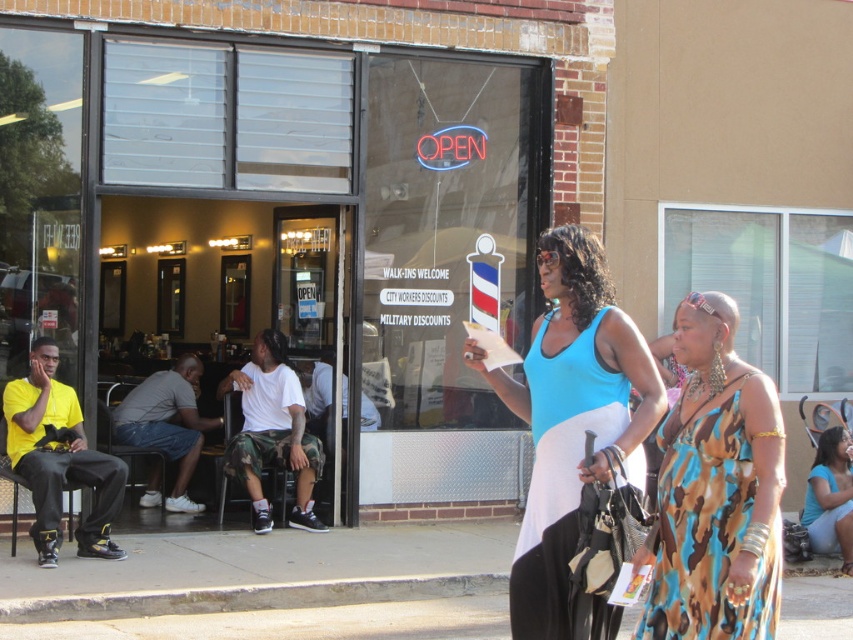
Question: Which of the following is the farthest from the observer?

Choices:
 (A) blue jersey dress at center
 (B) camouflage print dress at right

Answer: (A)

Question: Which of these objects is positioned farthest from the blue jersey dress at center?

Choices:
 (A) camouflage print dress at right
 (B) blue fabric dress at center

Answer: (A)

Question: Is blue fabric dress at center wider than blue jersey dress at center?

Choices:
 (A) no
 (B) yes

Answer: (B)

Question: Does blue fabric dress at center appear on the left side of blue jersey dress at center?

Choices:
 (A) yes
 (B) no

Answer: (A)

Question: Can you confirm if blue fabric dress at center is positioned to the left of camouflage print dress at right?

Choices:
 (A) no
 (B) yes

Answer: (B)

Question: Estimate the real-world distances between objects in this image. Which object is closer to the blue jersey dress at center?

Choices:
 (A) camouflage print dress at right
 (B) blue fabric dress at center

Answer: (B)